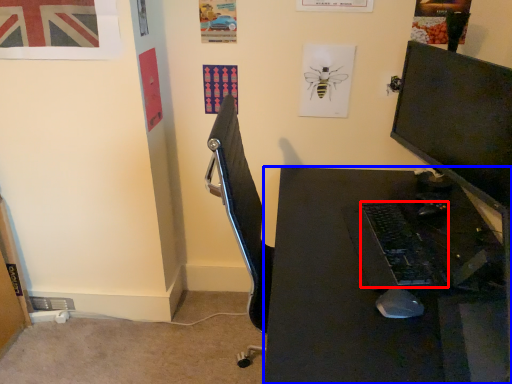
Question: Which of the following is the closest to the observer, computer keyboard (highlighted by a red box) or desk (highlighted by a blue box)?

Choices:
 (A) computer keyboard
 (B) desk

Answer: (B)